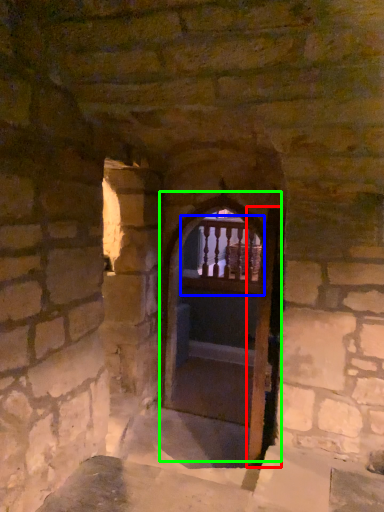
Question: Which is farther away from screen door (highlighted by a red box)? balcony (highlighted by a blue box) or door (highlighted by a green box)?

Choices:
 (A) balcony
 (B) door

Answer: (A)